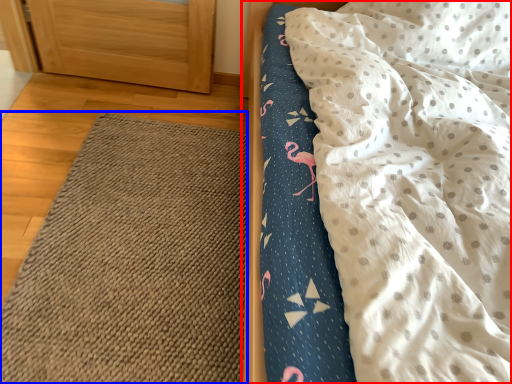
Question: Which point is further to the camera, bed (highlighted by a red box) or mat (highlighted by a blue box)?

Choices:
 (A) bed
 (B) mat

Answer: (B)